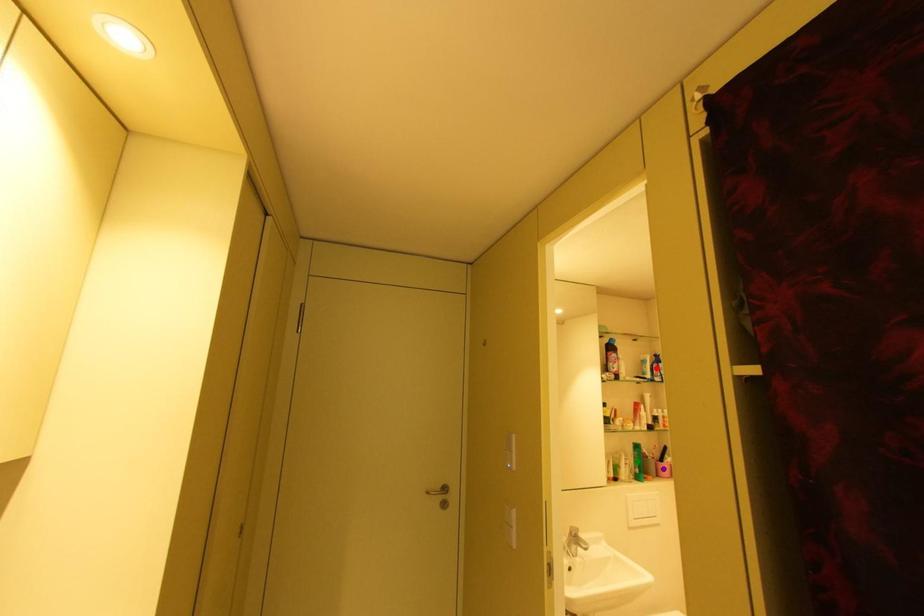
Order these from nearest to farthest:
A) purple point
B) green point
C) red point

purple point
green point
red point